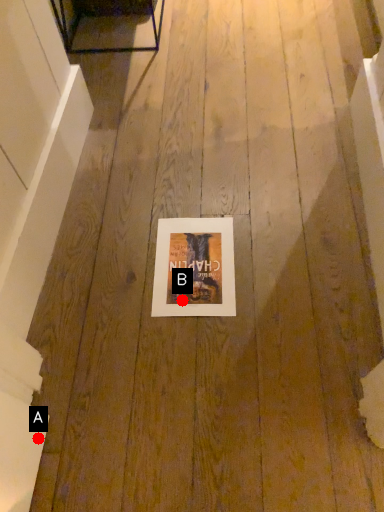
Question: Two points are circled on the image, labeled by A and B beside each circle. Which point is farther from the camera taking this photo?

Choices:
 (A) A is further
 (B) B is further

Answer: (B)